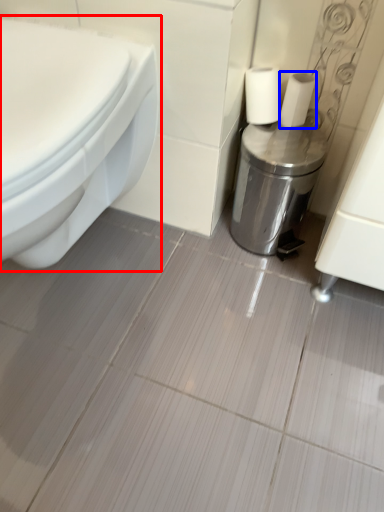
Question: Which of the following is the closest to the observer, toilet (highlighted by a red box) or toilet paper (highlighted by a blue box)?

Choices:
 (A) toilet
 (B) toilet paper

Answer: (A)